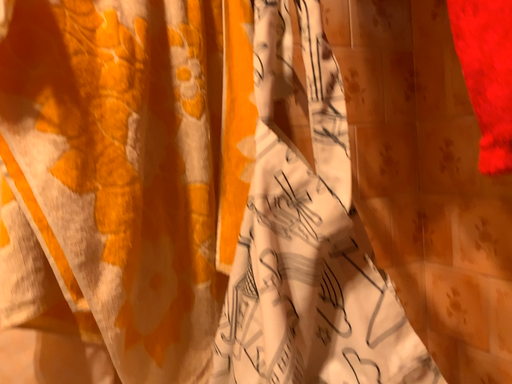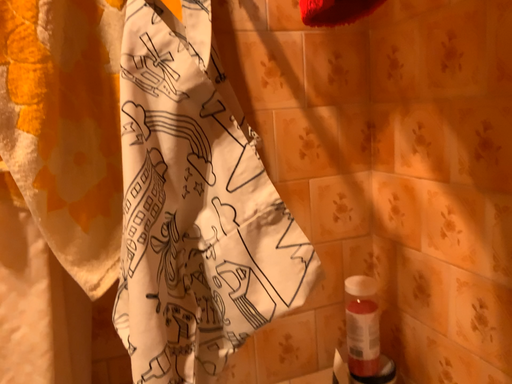
Question: How did the camera likely rotate when shooting the video?

Choices:
 (A) rotated downward
 (B) rotated upward

Answer: (A)